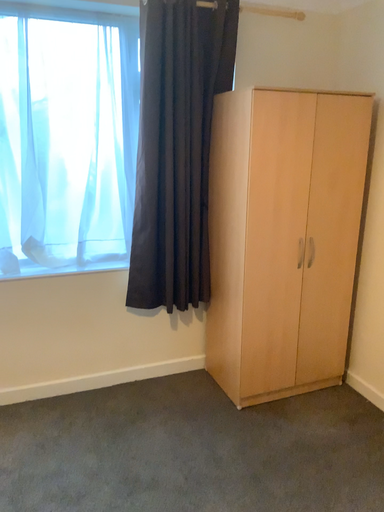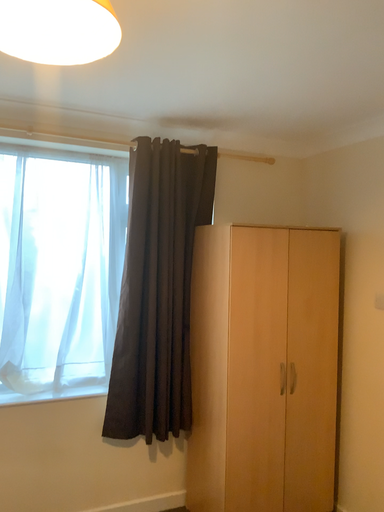
Question: How did the camera likely rotate when shooting the video?

Choices:
 (A) rotated upward
 (B) rotated downward

Answer: (A)